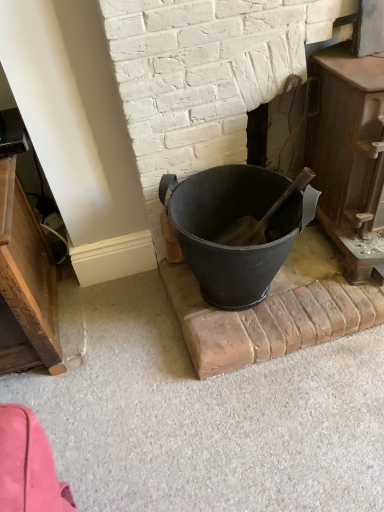
Question: Is matte black bucket at center behind rustic wood stove at right?

Choices:
 (A) no
 (B) yes

Answer: (B)

Question: From a real-world perspective, is matte black bucket at center physically above rustic wood stove at right?

Choices:
 (A) yes
 (B) no

Answer: (B)

Question: Does matte black bucket at center appear on the right side of rustic wood stove at right?

Choices:
 (A) yes
 (B) no

Answer: (B)

Question: Is matte black bucket at center not close to rustic wood stove at right?

Choices:
 (A) no
 (B) yes

Answer: (A)

Question: Is matte black bucket at center positioned beyond the bounds of rustic wood stove at right?

Choices:
 (A) no
 (B) yes

Answer: (B)

Question: Considering the relative sizes of matte black bucket at center and rustic wood stove at right in the image provided, is matte black bucket at center thinner than rustic wood stove at right?

Choices:
 (A) yes
 (B) no

Answer: (A)

Question: Is rustic wood stove at right facing away from matte black bucket at center?

Choices:
 (A) yes
 (B) no

Answer: (B)

Question: Is there a large distance between rustic wood stove at right and matte black bucket at center?

Choices:
 (A) no
 (B) yes

Answer: (A)

Question: From a real-world perspective, is rustic wood stove at right on top of matte black bucket at center?

Choices:
 (A) no
 (B) yes

Answer: (B)

Question: Does rustic wood stove at right have a larger size compared to matte black bucket at center?

Choices:
 (A) yes
 (B) no

Answer: (A)

Question: From the image's perspective, does rustic wood stove at right appear higher than matte black bucket at center?

Choices:
 (A) yes
 (B) no

Answer: (A)

Question: Can you confirm if rustic wood stove at right is positioned to the right of matte black bucket at center?

Choices:
 (A) yes
 (B) no

Answer: (A)

Question: Is point (233, 165) positioned closer to the camera than point (354, 224)?

Choices:
 (A) farther
 (B) closer

Answer: (A)